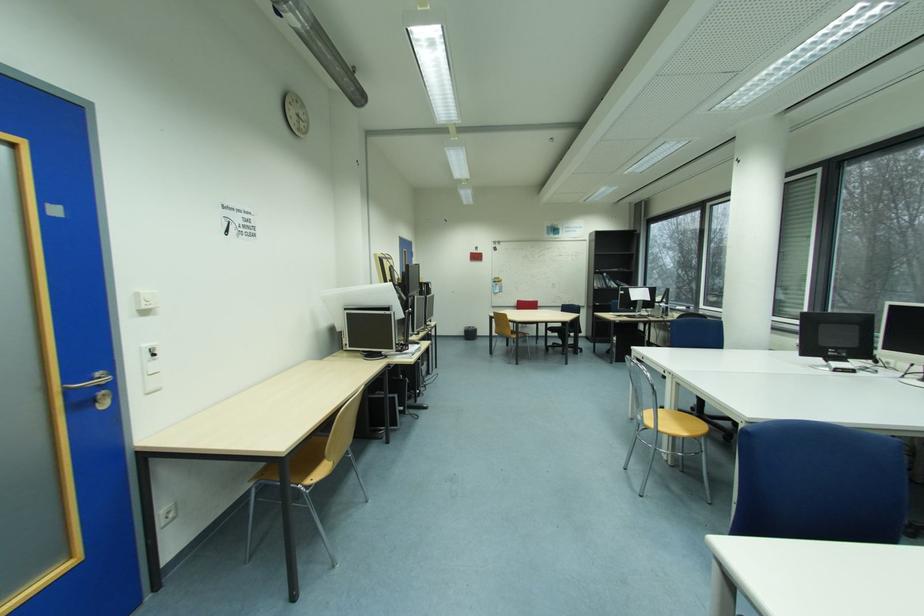
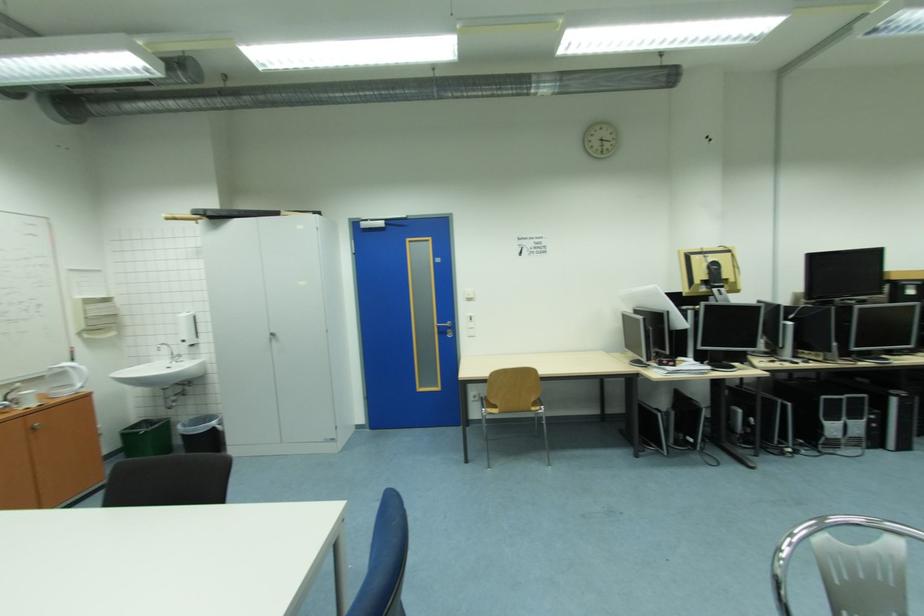
The point at (400, 399) is marked in the first image. Where is the corresponding point in the second image?

(663, 416)